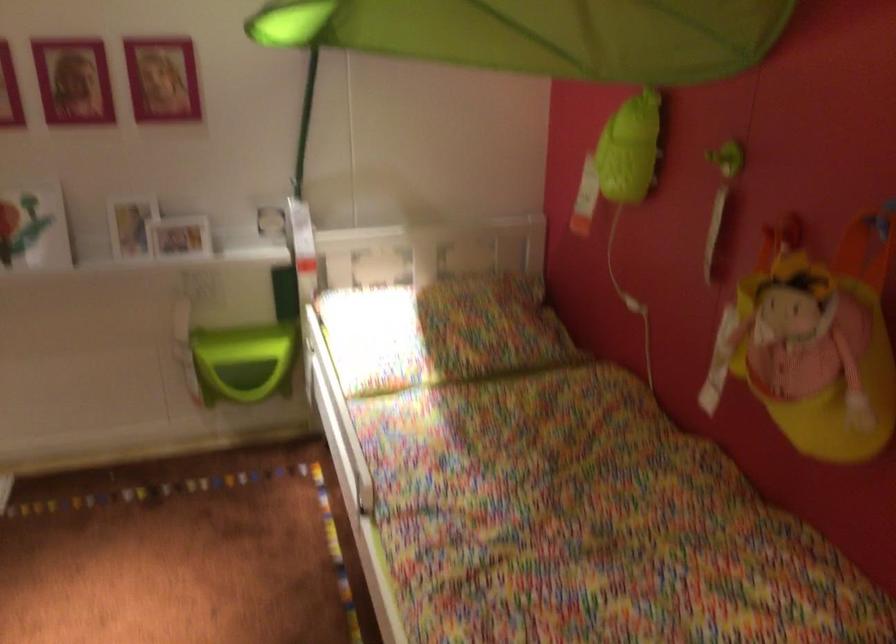
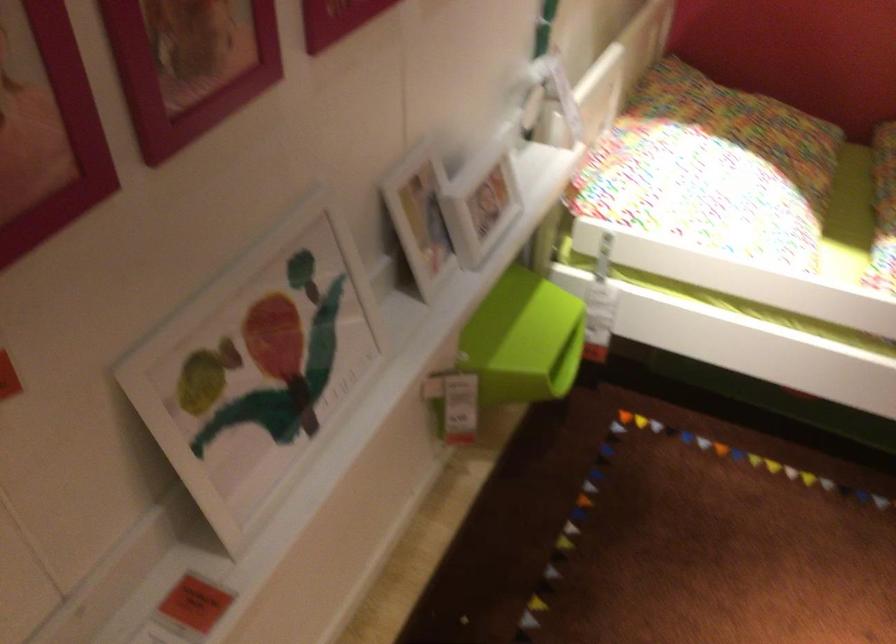
Find the pixel in the second image that matches (x=174, y=245) in the first image.

(479, 200)